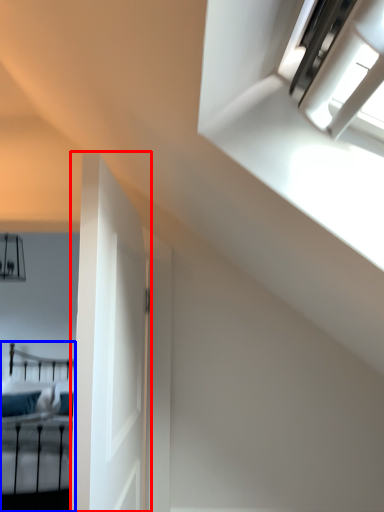
Question: Which object is further to the camera taking this photo, door (highlighted by a red box) or bed (highlighted by a blue box)?

Choices:
 (A) door
 (B) bed

Answer: (B)